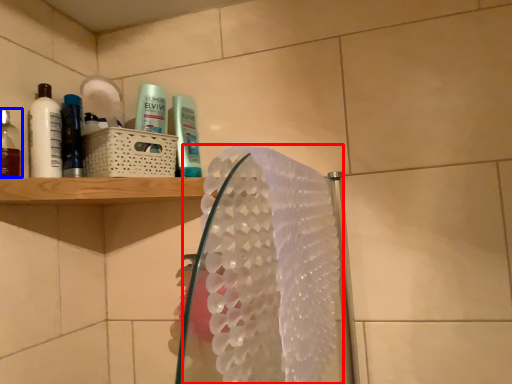
Question: Among these objects, which one is nearest to the camera, hand towel (highlighted by a red box) or mouthwash (highlighted by a blue box)?

Choices:
 (A) hand towel
 (B) mouthwash

Answer: (A)